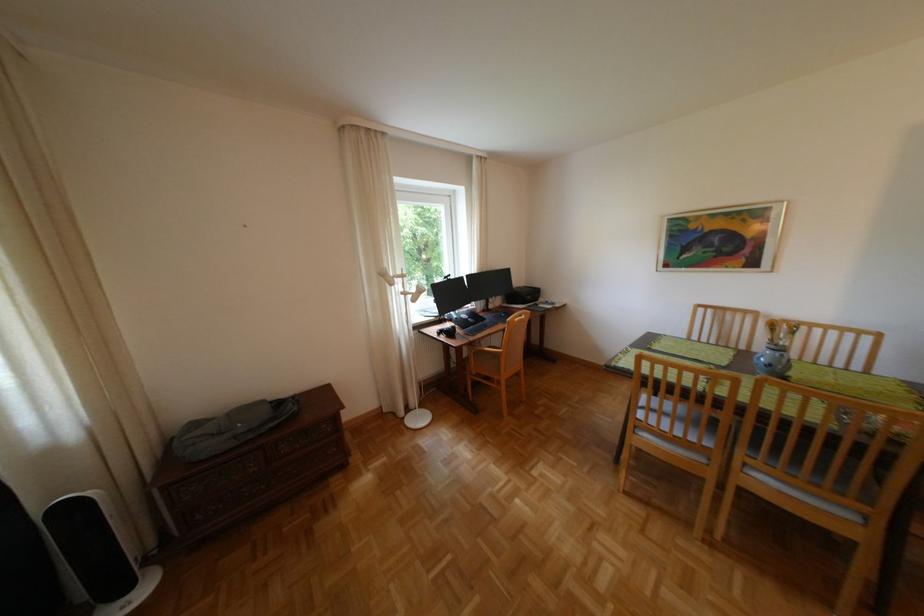
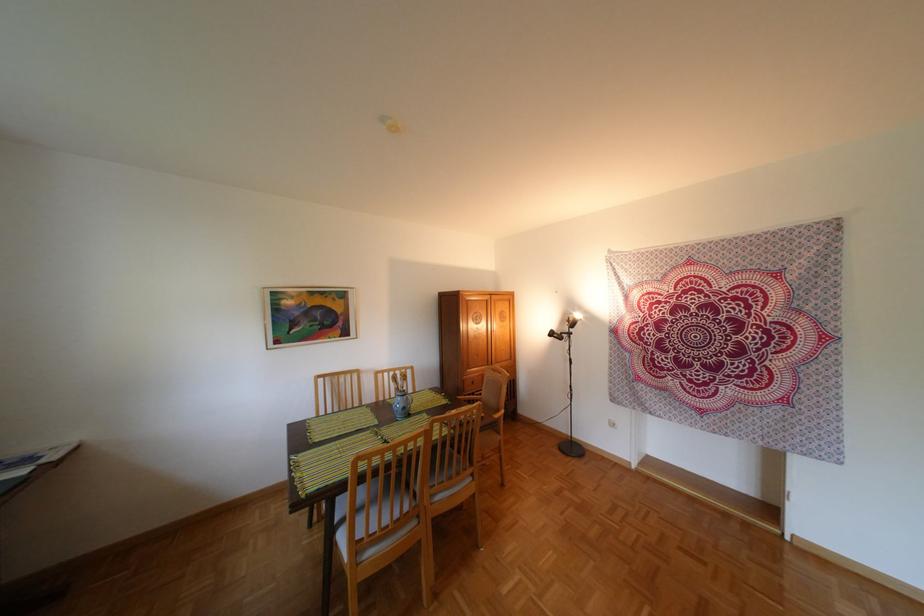
In the second image, find the point that corresponds to point (763, 461) in the first image.

(445, 491)